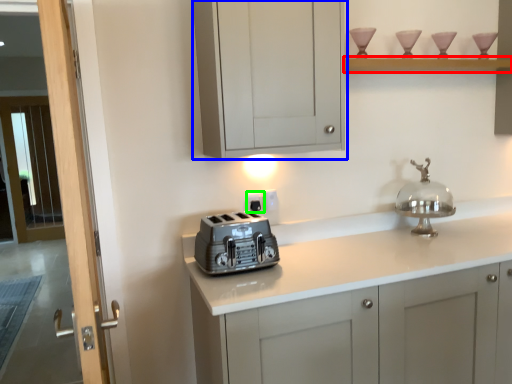
Question: Which object is the closest to the shelf (highlighted by a red box)? Choose among these: cabinetry (highlighted by a blue box) or electric outlet (highlighted by a green box).

Choices:
 (A) cabinetry
 (B) electric outlet

Answer: (A)